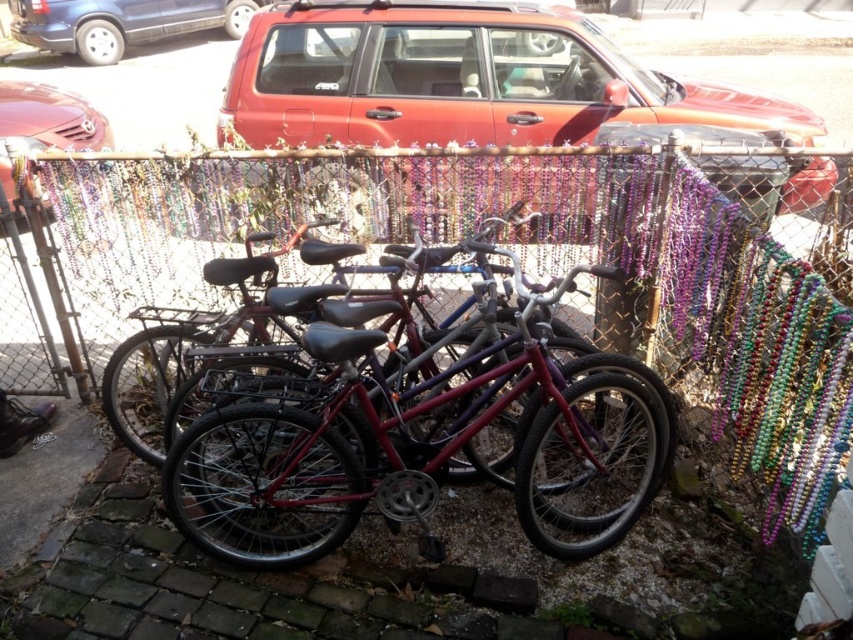
You are standing in front of the fenced area with bicycles. You notice two points marked on the ground. The first point is at coordinate point (660, 180) and the second point is at coordinate point (65, 26). Which point is closer to you?

Point (660, 180) is closer to the camera than point (65, 26), so the first point is closer to you.

You are standing at the entrance of the fenced area and want to park your matte red suv at center. Based on the scene, where should you position the vehicle?

The matte red suv at center should be positioned at the coordinates point (467, 81) as specified in the scene description.